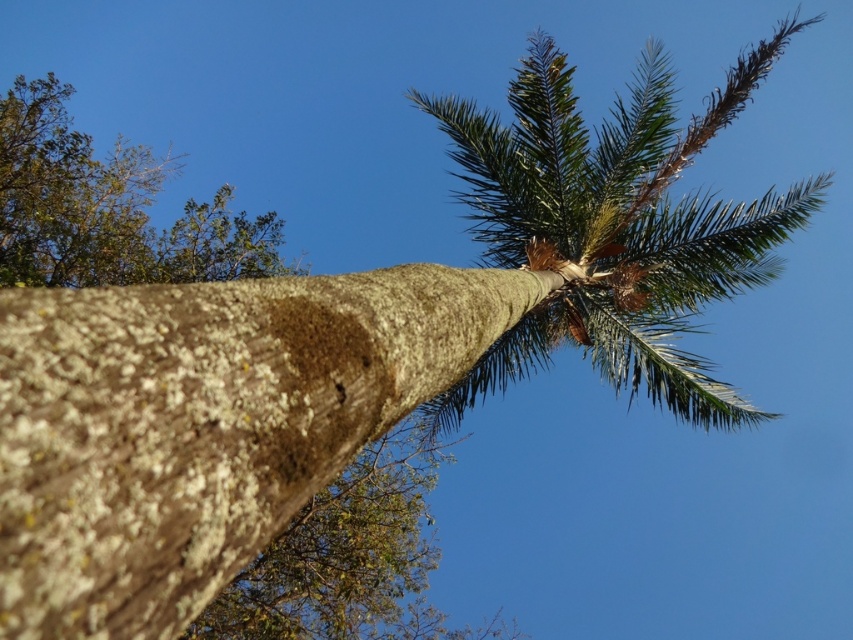
You are a botanist studying tree structures. You observe the brown rough bark at center and the green leafy tree at upper left in the image. Which of these two objects is taller?

The brown rough bark at center is taller than the green leafy tree at upper left according to the description.

In the scene shown: You are standing in front of the tree trunk shown in the image. There is a point marked at coordinates (x=204, y=424). What is located at this point on the tree trunk?

The point at coordinates (x=204, y=424) indicates the brown rough bark at center.